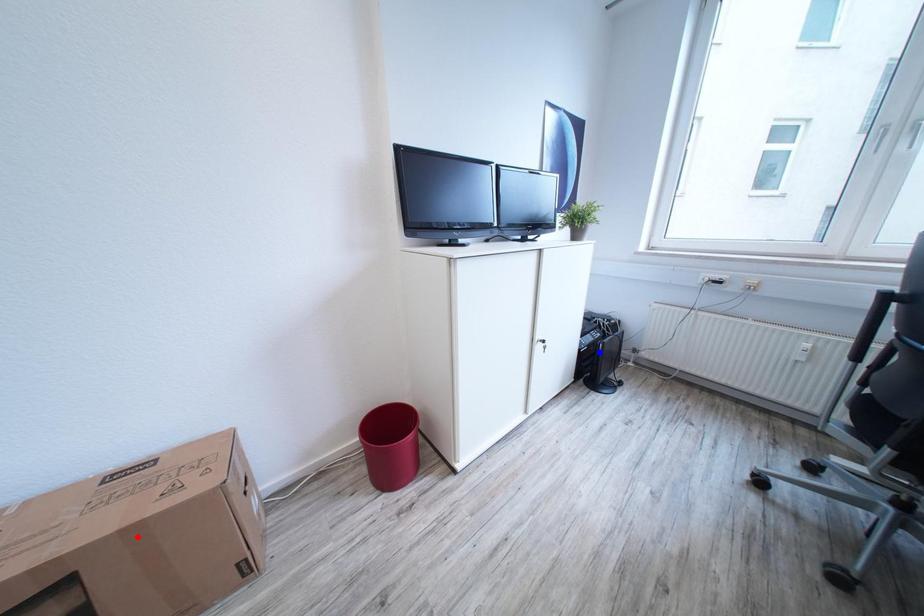
Question: In the image, two points are highlighted. Which point is nearer to the camera? Reply with the corresponding letter.

Choices:
 (A) blue point
 (B) red point

Answer: (B)